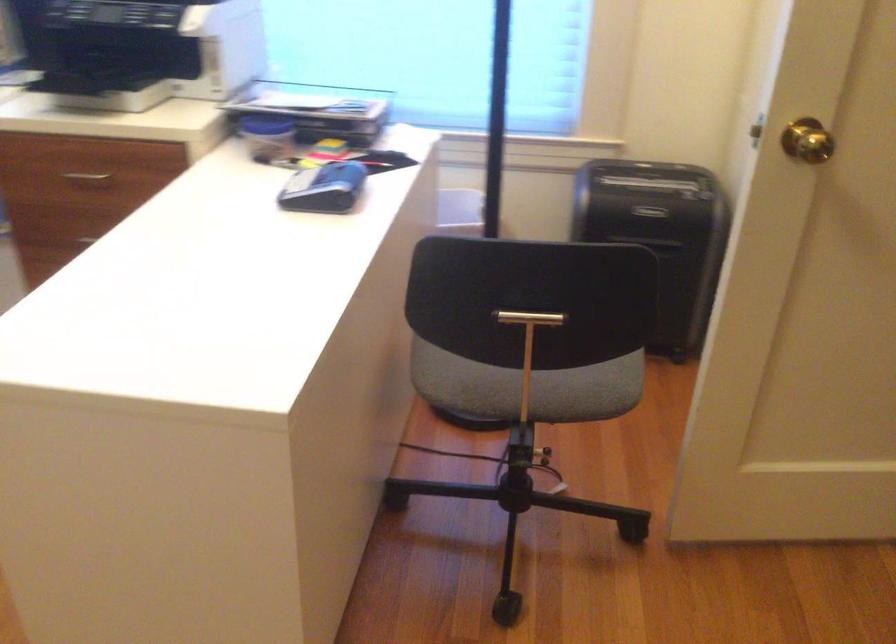
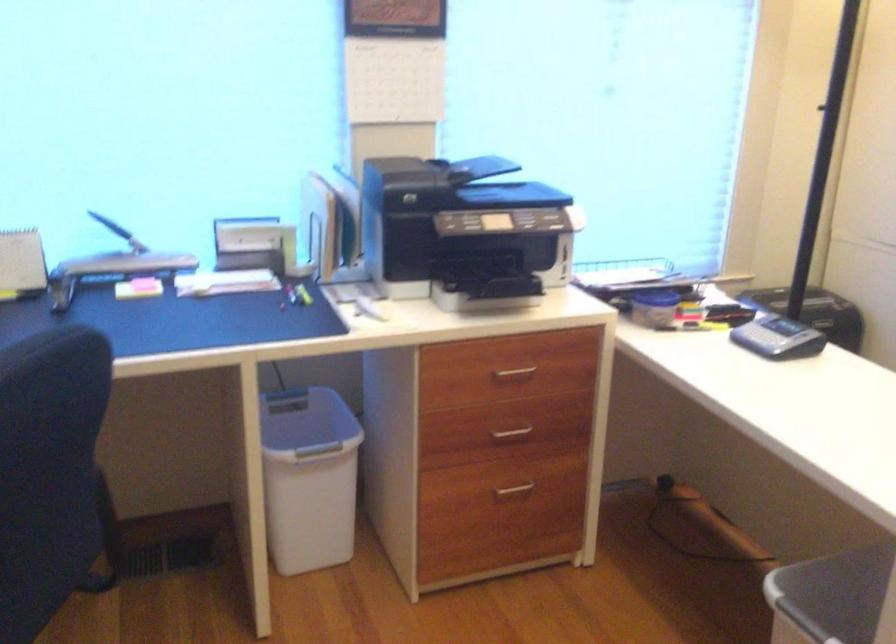
Find the pixel in the second image that matches the point at 316,190 in the first image.

(778, 337)